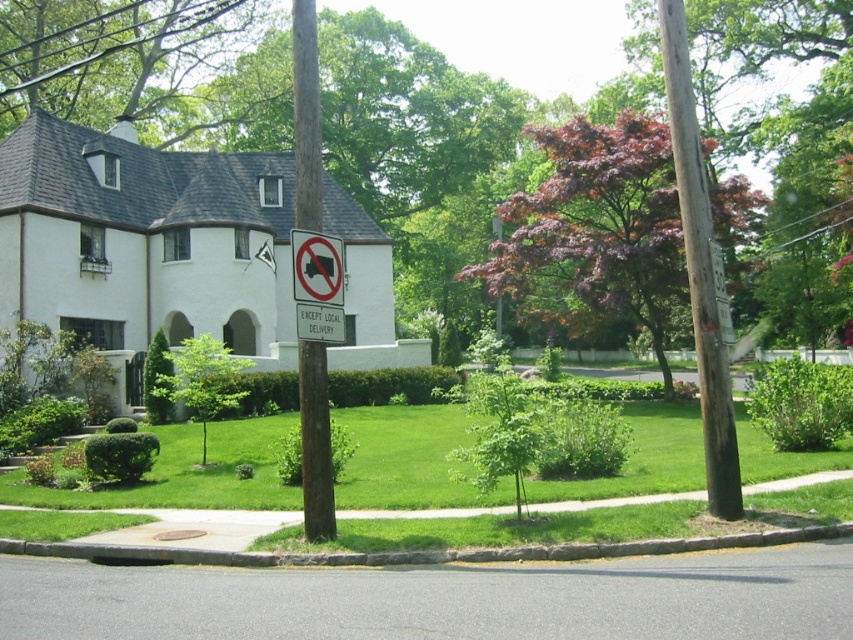
Based on the photo, you are standing at the entrance of the house and want to plant a new tree in the front yard. The purple leafy tree at center is located at point (144, 237). Where should you place the new tree so it won,t be too close to the existing purple leafy tree at center?

The purple leafy tree at center is located at point (144, 237). To avoid placing the new tree too close, choose a location farther than the recommended spacing distance for tree species, ensuring adequate space for growth.

You are a delivery driver in a matte black truck at center. You need to park your truck near the purple glossy tree at center without blocking the street. Is there enough space between them to park your truck?

The distance between the purple glossy tree at center and the matte black truck at center is 24.97 meters. Since the truck requires less than 24.97 meters to park, there is sufficient space to park the truck without blocking the street.

You are a delivery truck driver who needs to park your truck near the house. The parking area must be between the purple glossy tree at center and the green leafy tree at upper left. The truck requires a parking space of at least 15 meters. Can you park your truck there?

The distance between the purple glossy tree at center and the green leafy tree at upper left is 17.36 meters, which is more than the required 15 meters. Therefore, the truck can park in that area.